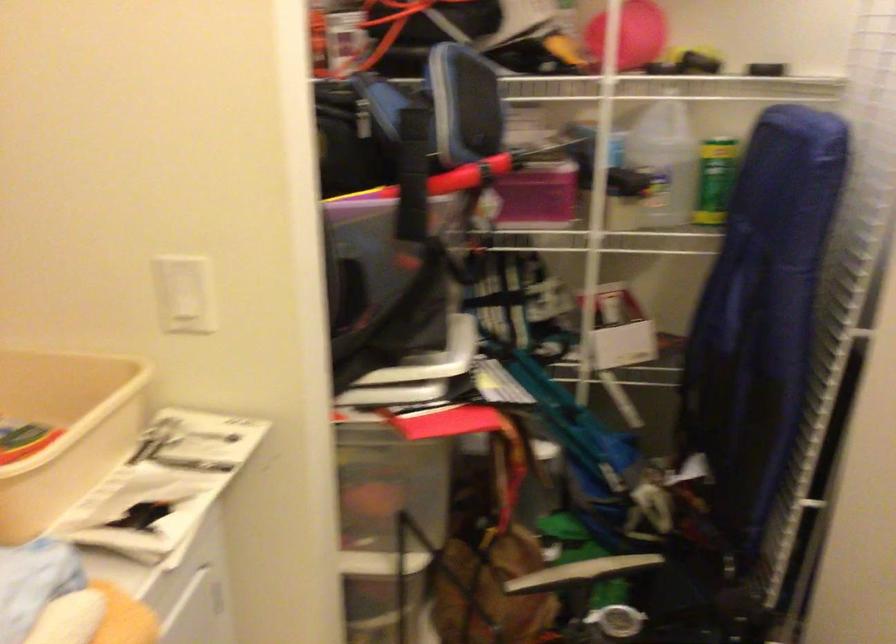
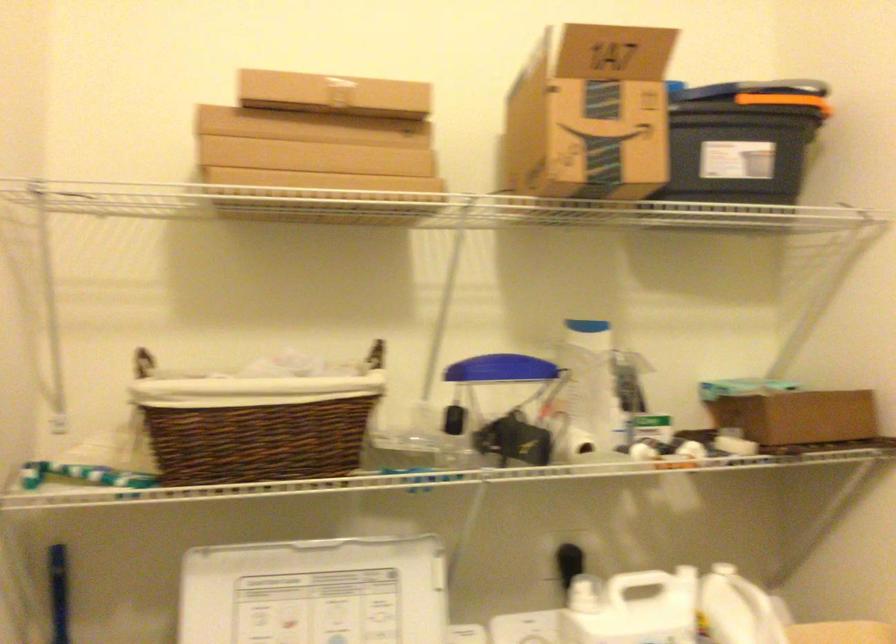
Question: The camera is either moving clockwise (left) or counter-clockwise (right) around the object. The first image is from the beginning of the video and the second image is from the end. Is the camera moving left or right when shooting the video?

Choices:
 (A) Left
 (B) Right

Answer: (B)